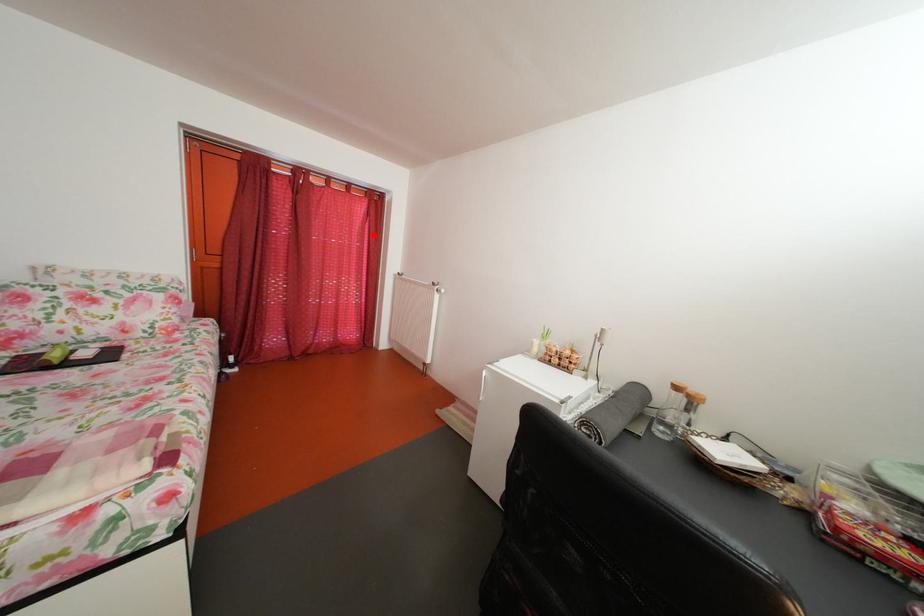
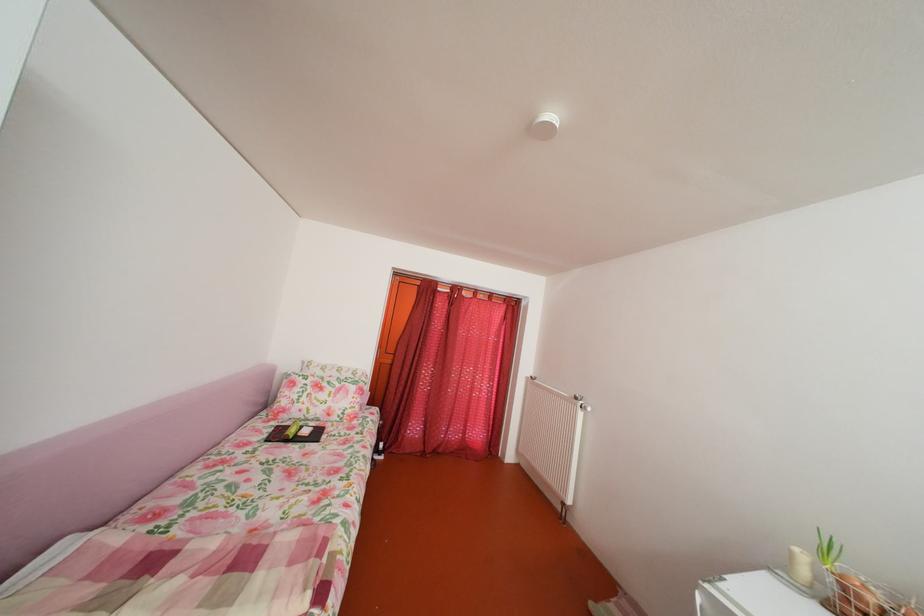
Locate, in the second image, the point that corresponds to the highlighted location in the first image.

(511, 337)